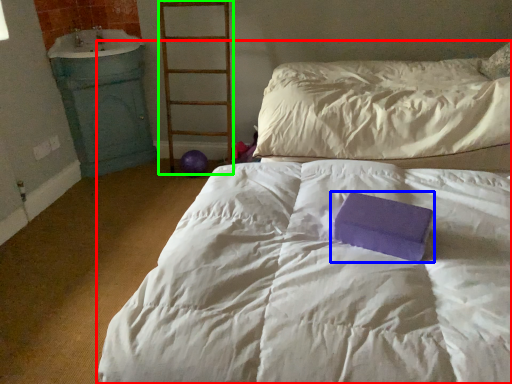
Question: Considering the real-world distances, which object is farthest from bed (highlighted by a red box)? paperback book (highlighted by a blue box) or ladder (highlighted by a green box)?

Choices:
 (A) paperback book
 (B) ladder

Answer: (B)